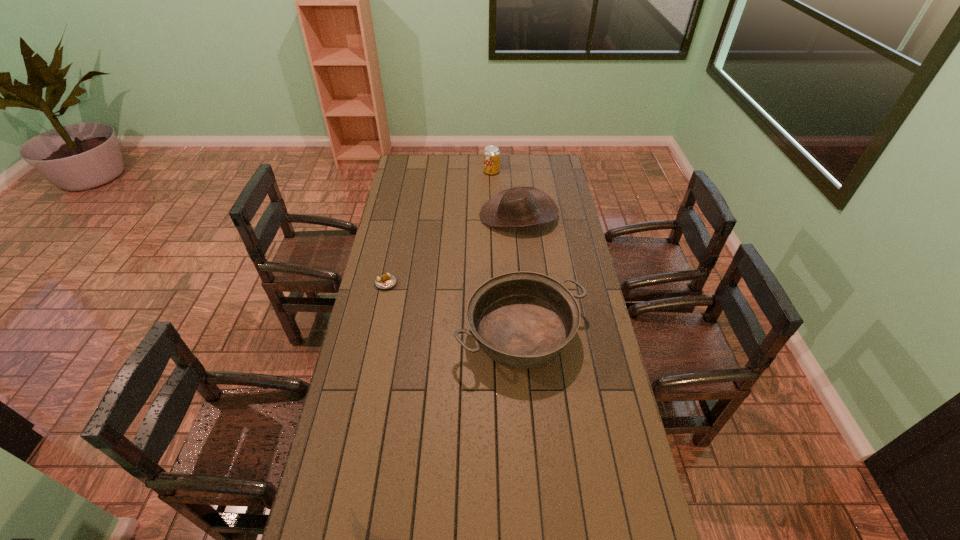
Identify which object is the closest to the nearest object. Please provide its 2D coordinates. Your answer should be formatted as a tuple, i.e. [(x, y)], where the tuple contains the x and y coordinates of a point satisfying the conditions above.

[(385, 281)]

Point out which object is positioned as the second nearest to the second farthest object. Please provide its 2D coordinates. Your answer should be formatted as a tuple, i.e. [(x, y)], where the tuple contains the x and y coordinates of a point satisfying the conditions above.

[(522, 320)]

At what (x,y) coordinates should I click in order to perform the action: click on vacant position in the image that satisfies the following two spatial constraints: 1. on the front side of the second farthest object; 2. on the left side of the farthest object. Please return your answer as a coordinate pair (x, y). Looking at the image, I should click on (492, 215).

What are the coordinates of `free space that satisfies the following two spatial constraints: 1. on the front side of the pan; 2. on the left side of the leftmost object` in the screenshot? It's located at (375, 333).